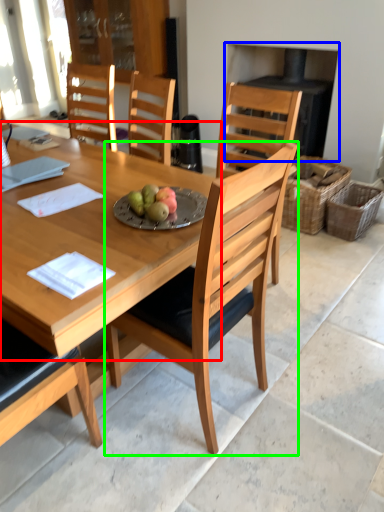
Question: Which object is the closest to the round table (highlighted by a red box)? Choose among these: fireplace (highlighted by a blue box) or chair (highlighted by a green box).

Choices:
 (A) fireplace
 (B) chair

Answer: (B)